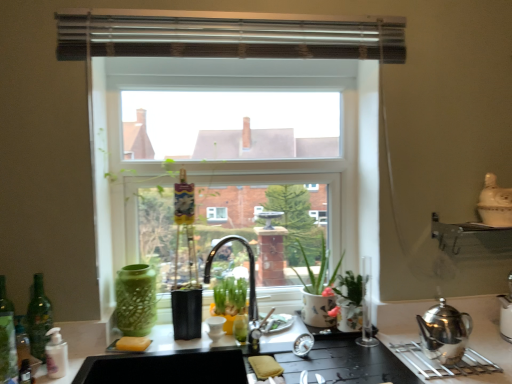
Image resolution: width=512 pixels, height=384 pixels. Identify the location of vacant point above metallic silver exhaust hood at upper center (from a real-world perspective). (224, 8).